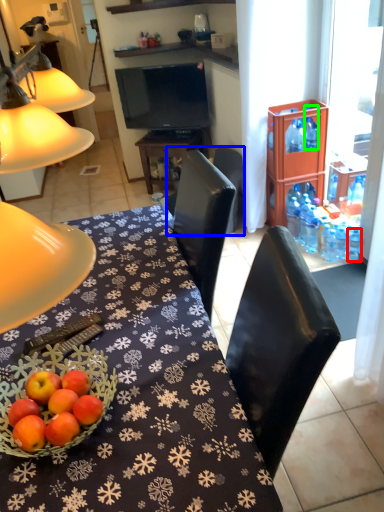
Question: Which object is the closest to the bottle (highlighted by a red box)? Choose among these: chair (highlighted by a blue box) or bottle (highlighted by a green box).

Choices:
 (A) chair
 (B) bottle

Answer: (B)